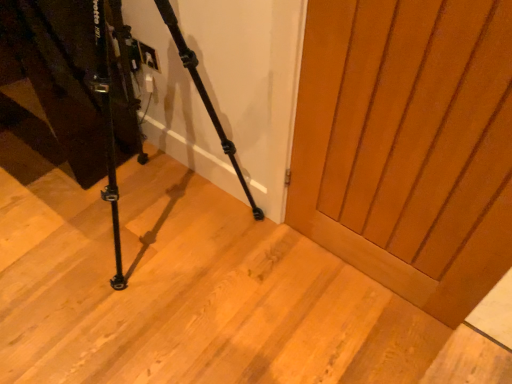
The height and width of the screenshot is (384, 512). What do you see at coordinates (108, 133) in the screenshot?
I see `black matte tripod at lower left` at bounding box center [108, 133].

Identify the location of black matte tripod at lower left. Image resolution: width=512 pixels, height=384 pixels. (108, 133).

In order to face matte wood door at center, should I rotate leftwards or rightwards?

To face it directly, rotate right by 18.292 degrees.

This screenshot has height=384, width=512. Identify the location of matte wood door at center. (408, 145).

Image resolution: width=512 pixels, height=384 pixels. Describe the element at coordinates (408, 145) in the screenshot. I see `matte wood door at center` at that location.

Image resolution: width=512 pixels, height=384 pixels. I want to click on black matte tripod at lower left, so click(x=108, y=133).

Considering the relative positions of matte wood door at center and black matte tripod at lower left in the image provided, is matte wood door at center to the left of black matte tripod at lower left from the viewer's perspective?

No.

Which object is more forward, matte wood door at center or black matte tripod at lower left?

black matte tripod at lower left.

Does point (305, 211) appear closer or farther from the camera than point (166, 2)?

Point (305, 211) is positioned farther from the camera compared to point (166, 2).

From the image's perspective, between matte wood door at center and black matte tripod at lower left, who is located below?

matte wood door at center, from the image's perspective.

From a real-world perspective, does matte wood door at center sit lower than black matte tripod at lower left?

Correct, in the physical world, matte wood door at center is lower than black matte tripod at lower left.

Considering the relative sizes of matte wood door at center and black matte tripod at lower left in the image provided, is matte wood door at center wider than black matte tripod at lower left?

No.

Which of these two, matte wood door at center or black matte tripod at lower left, stands taller?

black matte tripod at lower left.

Does matte wood door at center have a larger size compared to black matte tripod at lower left?

Incorrect, matte wood door at center is not larger than black matte tripod at lower left.

Is matte wood door at center located outside black matte tripod at lower left?

Yes, matte wood door at center is outside of black matte tripod at lower left.

Are matte wood door at center and black matte tripod at lower left far apart?

No, there isn't a large distance between matte wood door at center and black matte tripod at lower left.

Is matte wood door at center turned away from black matte tripod at lower left?

No.

You are a GUI agent. You are given a task and a screenshot of the screen. Output one action in this format:
    pyautogui.click(x=<x>, y=<y>)
    Task: Click on the door located on the right of black matte tripod at lower left
    This screenshot has width=512, height=384.
    Given the screenshot: What is the action you would take?
    pyautogui.click(x=408, y=145)

Is black matte tripod at lower left to the right of matte wood door at center from the viewer's perspective?

No.

Between black matte tripod at lower left and matte wood door at center, which one is positioned in front?

black matte tripod at lower left.

Which is less distant, (114, 281) or (467, 57)?

Point (114, 281) is positioned farther from the camera compared to point (467, 57).

From the image's perspective, who appears lower, black matte tripod at lower left or matte wood door at center?

From the image's view, matte wood door at center is below.

Based on the photo, from a real-world perspective, who is located higher, black matte tripod at lower left or matte wood door at center?

In real-world perspective, black matte tripod at lower left is above.

Which of these two, black matte tripod at lower left or matte wood door at center, is thinner?

With smaller width is matte wood door at center.

Considering the sizes of objects black matte tripod at lower left and matte wood door at center in the image provided, who is shorter, black matte tripod at lower left or matte wood door at center?

matte wood door at center.

Looking at the image, does black matte tripod at lower left seem bigger or smaller compared to matte wood door at center?

In the image, black matte tripod at lower left appears to be larger than matte wood door at center.

Is matte wood door at center located within black matte tripod at lower left?

No, black matte tripod at lower left does not contain matte wood door at center.

From the picture: Is black matte tripod at lower left next to matte wood door at center and touching it?

No, black matte tripod at lower left is not in contact with matte wood door at center.

Is black matte tripod at lower left oriented away from matte wood door at center?

black matte tripod at lower left is not turned away from matte wood door at center.

How distant is black matte tripod at lower left from matte wood door at center?

They are 21.40 inches apart.

Where is `door on the right of black matte tripod at lower left`? door on the right of black matte tripod at lower left is located at coordinates (408, 145).

Where is `door that appears on the right of black matte tripod at lower left`? door that appears on the right of black matte tripod at lower left is located at coordinates (408, 145).

Where is `door behind the black matte tripod at lower left`? This screenshot has height=384, width=512. door behind the black matte tripod at lower left is located at coordinates (408, 145).